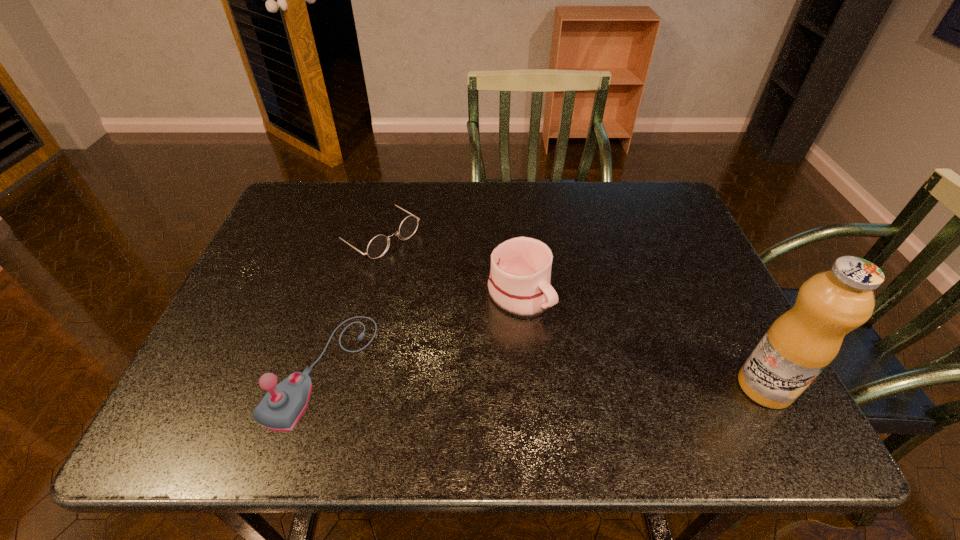
At what (x,y) coordinates should I click in order to perform the action: click on empty space between the shortest object and the rightmost object. Please return your answer as a coordinate pair (x, y). This screenshot has height=540, width=960. Looking at the image, I should click on (569, 310).

Find the location of a particular element. This screenshot has height=540, width=960. vacant point located between the shortest object and the mug is located at coordinates (446, 264).

Identify the location of free area in between the tallest object and the farthest object. (569, 310).

This screenshot has width=960, height=540. In order to click on blank region between the mug and the fruit juice in this screenshot , I will do click(x=642, y=340).

At what (x,y) coordinates should I click in order to perform the action: click on vacant space in between the second object from right to left and the joystick. Please return your answer as a coordinate pair (x, y). This screenshot has width=960, height=540. Looking at the image, I should click on (420, 332).

Find the location of a particular element. unoccupied area between the joystick and the spectacles is located at coordinates [348, 301].

The image size is (960, 540). Find the location of `object that stands as the second closest to the second object from right to left`. object that stands as the second closest to the second object from right to left is located at coordinates (281, 408).

Identify the location of object identified as the closest to the second object from right to left. The image size is (960, 540). (376, 248).

At what (x,y) coordinates should I click in order to perform the action: click on free location that satisfies the following two spatial constraints: 1. on the front side of the rightmost object; 2. on the front label of the mug. Please return your answer as a coordinate pair (x, y). Looking at the image, I should click on (528, 387).

What are the coordinates of `vacant region that satisfies the following two spatial constraints: 1. on the front side of the joystick; 2. on the front label of the tallest object` in the screenshot? It's located at (317, 387).